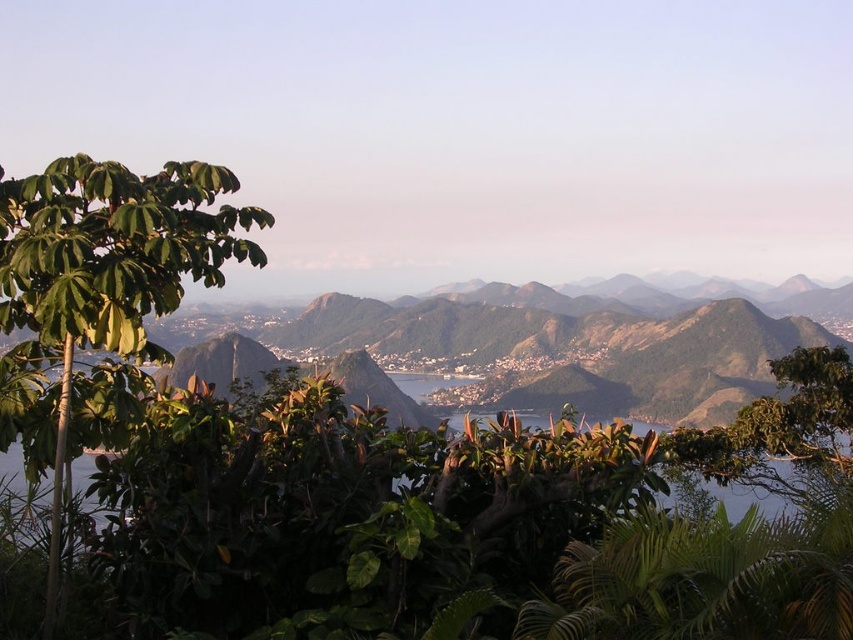
You are standing at the point marked as point [106,276] in the image. What do you see immediately to your left?

To your left at point [106,276] is a green leafy tree.

You are standing at the vantage point and want to walk towards the green leafy tree at left and the green leafy tree at center. Which tree will you reach first?

The green leafy tree at left is closer to the viewer than the green leafy tree at center, so you will reach the green leafy tree at left first.